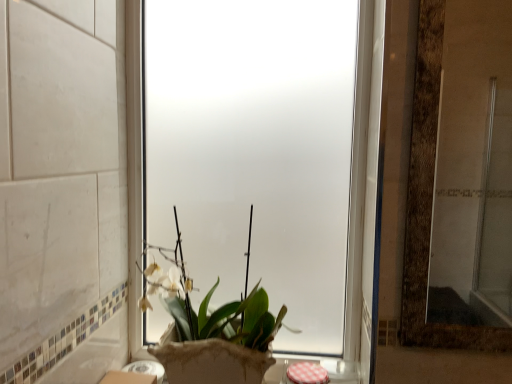
Question: Is point [x=354, y=193] positioned closer to the camera than point [x=151, y=276]?

Choices:
 (A) farther
 (B) closer

Answer: (A)

Question: Looking at their shapes, would you say frosted glass window at center is wider or thinner than green matte plant at center?

Choices:
 (A) wide
 (B) thin

Answer: (B)

Question: From a real-world perspective, relative to green matte plant at center, is frosted glass window at center vertically above or below?

Choices:
 (A) below
 (B) above

Answer: (B)

Question: In terms of size, does green matte plant at center appear bigger or smaller than frosted glass window at center?

Choices:
 (A) big
 (B) small

Answer: (A)

Question: Is green matte plant at center wider or thinner than frosted glass window at center?

Choices:
 (A) wide
 (B) thin

Answer: (A)

Question: Is green matte plant at center inside or outside of frosted glass window at center?

Choices:
 (A) inside
 (B) outside

Answer: (B)

Question: In the image, is green matte plant at center on the left side or the right side of frosted glass window at center?

Choices:
 (A) right
 (B) left

Answer: (B)